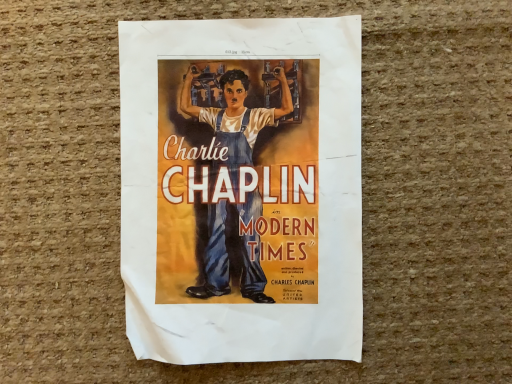
You are a GUI agent. You are given a task and a screenshot of the screen. Output one action in this format:
    pyautogui.click(x=<x>, y=<y>)
    Task: Click on the empty space that is ontop of matte paper poster at center (from a real-world perspective)
    The height and width of the screenshot is (384, 512).
    Given the screenshot: What is the action you would take?
    pyautogui.click(x=252, y=187)